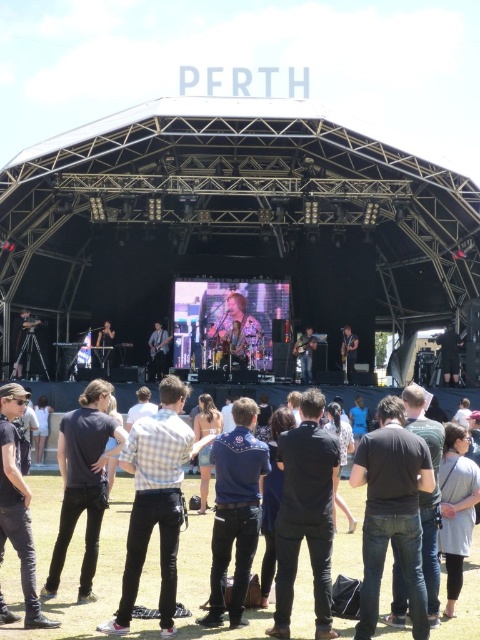
Can you confirm if black denim jeans at center is positioned to the left of black matte shirt at center?

No, black denim jeans at center is not to the left of black matte shirt at center.

Between point (383, 474) and point (277, 556), which one is positioned in front?

Point (383, 474) is more forward.

Find the location of a particular element. This screenshot has height=640, width=480. black denim jeans at center is located at coordinates (392, 513).

Can you confirm if denim jeans at center is positioned to the left of black leather jacket at lower left?

No, denim jeans at center is not to the left of black leather jacket at lower left.

Does denim jeans at center have a lesser height compared to black leather jacket at lower left?

Correct, denim jeans at center is not as tall as black leather jacket at lower left.

The height and width of the screenshot is (640, 480). Describe the element at coordinates (95, 577) in the screenshot. I see `denim jeans at center` at that location.

At what (x,y) coordinates should I click in order to perform the action: click on denim jeans at center. Please return your answer as a coordinate pair (x, y). This screenshot has height=640, width=480. Looking at the image, I should click on (95, 577).

Can you confirm if black leather jacket at lower left is positioned to the right of green fabric guitar at center?

Incorrect, black leather jacket at lower left is not on the right side of green fabric guitar at center.

Does point (21, 556) come in front of point (300, 380)?

Yes, point (21, 556) is in front of point (300, 380).

The height and width of the screenshot is (640, 480). I want to click on black leather jacket at lower left, so click(x=17, y=502).